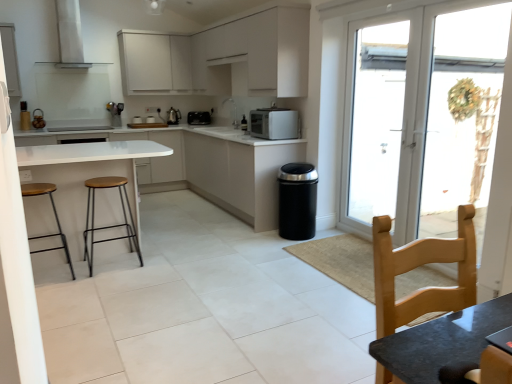
Question: Could you tell me if wooden seat and metal frame stool at left, positioned as the 2th stool in left-to-right order, is facing white glossy sink at center?

Choices:
 (A) no
 (B) yes

Answer: (A)

Question: Is wooden seat and metal frame stool at left, positioned as the 2th stool in left-to-right order, bigger than white glossy sink at center?

Choices:
 (A) no
 (B) yes

Answer: (B)

Question: From the image's perspective, does wooden seat and metal frame stool at left, positioned as the 2th stool in left-to-right order, appear higher than white glossy sink at center?

Choices:
 (A) no
 (B) yes

Answer: (A)

Question: Is wooden seat and metal frame stool at left, which is counted as the 1th stool, starting from the right, not inside white glossy sink at center?

Choices:
 (A) yes
 (B) no

Answer: (A)

Question: Are wooden seat and metal frame stool at left, positioned as the 2th stool in left-to-right order, and white glossy sink at center located far from each other?

Choices:
 (A) no
 (B) yes

Answer: (B)

Question: Is the position of wooden seat and metal frame stool at left, which is counted as the 1th stool, starting from the right, less distant than that of white glossy sink at center?

Choices:
 (A) no
 (B) yes

Answer: (B)

Question: Is there a large distance between satin silver microwave at center, which is the second kitchen appliance from top to bottom, and metallic silver coffee machine at center?

Choices:
 (A) yes
 (B) no

Answer: (A)

Question: Considering the relative sizes of satin silver microwave at center, the second kitchen appliance viewed from the back, and metallic silver coffee machine at center in the image provided, is satin silver microwave at center, the second kitchen appliance viewed from the back, wider than metallic silver coffee machine at center?

Choices:
 (A) yes
 (B) no

Answer: (A)

Question: Is metallic silver coffee machine at center located within satin silver microwave at center, the second kitchen appliance viewed from the back?

Choices:
 (A) yes
 (B) no

Answer: (B)

Question: From a real-world perspective, is satin silver microwave at center, the second kitchen appliance viewed from the back, under metallic silver coffee machine at center?

Choices:
 (A) yes
 (B) no

Answer: (B)

Question: Can you confirm if satin silver microwave at center, the 1th kitchen appliance viewed from the front, is smaller than metallic silver coffee machine at center?

Choices:
 (A) yes
 (B) no

Answer: (B)

Question: Does satin silver microwave at center, arranged as the second kitchen appliance when viewed from the left, have a larger size compared to metallic silver coffee machine at center?

Choices:
 (A) no
 (B) yes

Answer: (B)

Question: From a real-world perspective, is white matte cabinetry at center, the fourth cabinetry positioned from the top, under light wood chair at lower right?

Choices:
 (A) no
 (B) yes

Answer: (B)